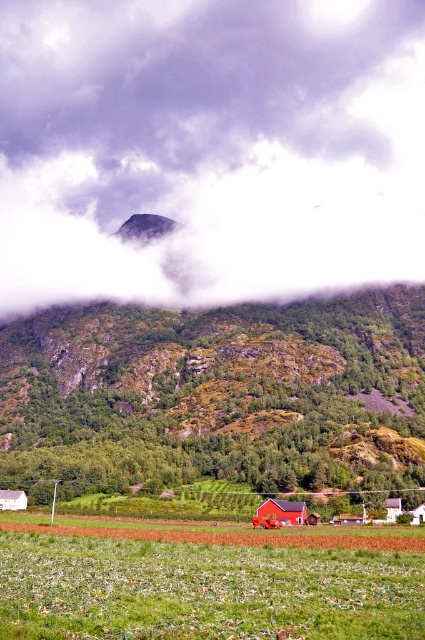
Question: Estimate the real-world distances between objects in this image. Which object is farther from the white fluffy cloud at upper center?

Choices:
 (A) matte red barn at center
 (B) green grass at lower center

Answer: (A)

Question: Which is nearer to the green grass at lower center?

Choices:
 (A) matte red barn at center
 (B) white fluffy cloud at upper center

Answer: (A)

Question: Considering the relative positions of green grass at lower center and matte red barn at center in the image provided, where is green grass at lower center located with respect to matte red barn at center?

Choices:
 (A) above
 (B) below

Answer: (A)

Question: Is white fluffy cloud at upper center bigger than matte red barn at center?

Choices:
 (A) yes
 (B) no

Answer: (A)

Question: Is the position of green grass at lower center more distant than that of matte red barn at center?

Choices:
 (A) no
 (B) yes

Answer: (A)

Question: Which of the following is the farthest from the observer?

Choices:
 (A) matte red barn at center
 (B) green grass at lower center
 (C) white fluffy cloud at upper center

Answer: (C)